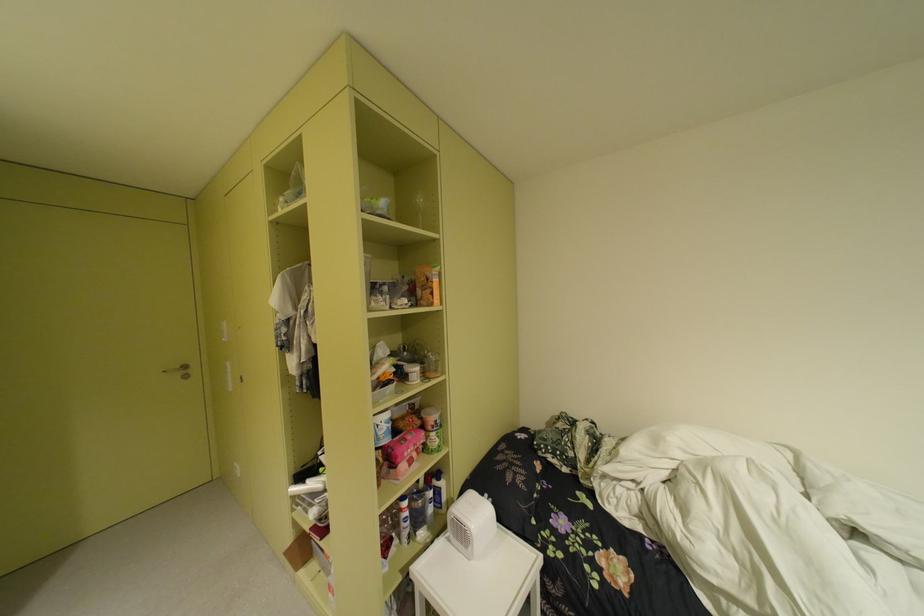
At what (x,y) coordinates should I click in order to perform the action: click on silver door handle. Please return your answer as a coordinate pair (x, y). This screenshot has width=924, height=616. Looking at the image, I should click on [178, 371].